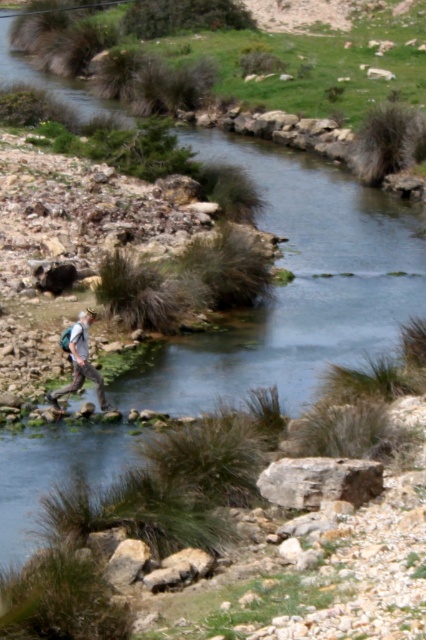
Between point (317, 460) and point (74, 387), which one is positioned behind?

Positioned behind is point (74, 387).

This screenshot has height=640, width=426. I want to click on rusty metallic rock at center, so click(x=319, y=481).

Who is lower down, clear water stream at center or light gray backpack at left?

light gray backpack at left

Who is higher up, clear water stream at center or light gray backpack at left?

clear water stream at center is above.

Find the location of `clear water stream at center`. clear water stream at center is located at coordinates (299, 285).

Find the location of a particular element. The width and height of the screenshot is (426, 640). clear water stream at center is located at coordinates (299, 285).

Between point (143, 400) and point (299, 468), which one is positioned behind?

Positioned behind is point (143, 400).

Which is in front, point (25, 80) or point (336, 496)?

Point (336, 496) is more forward.

Is point (371, 324) closer to camera compared to point (377, 488)?

That is False.

At what (x,y) coordinates should I click in order to perform the action: click on clear water stream at center. Please return your answer as a coordinate pair (x, y). Image resolution: width=426 pixels, height=640 pixels. Looking at the image, I should click on (299, 285).